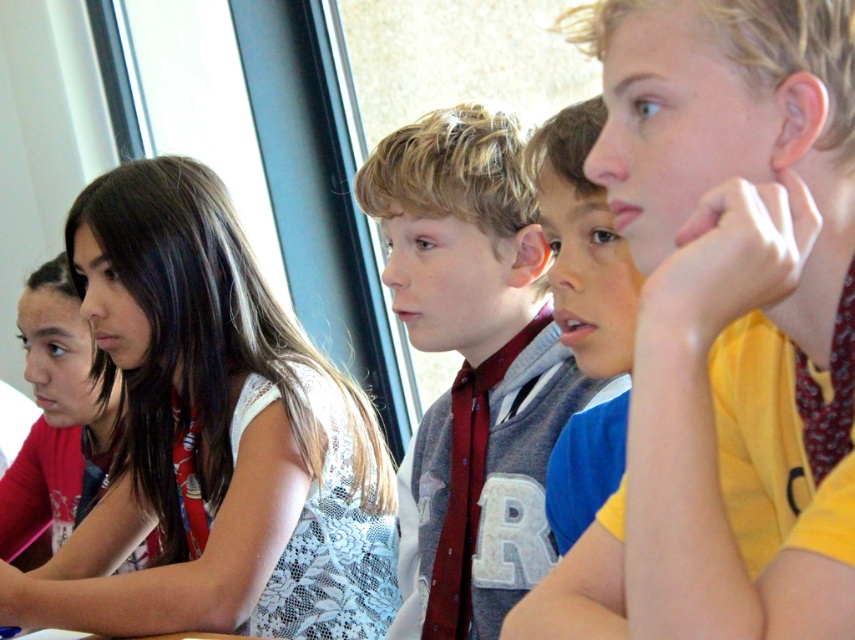
From the picture: You are a photographer trying to capture a group shot of the children in the classroom. You want to ensure that both the white lace dress at upper left and the maroon tie at center are visible in the frame. Based on their positions, which child should you position closer to the center of the photo to include both effectively?

The white lace dress at upper left is positioned on the left side of the maroon tie at center. To include both effectively, you should position the child wearing the maroon tie at center closer to the center of the photo so that the white lace dress at upper left remains visible on the left side.

You are a tailor who needs to determine which clothing item requires more fabric between the white lace dress at upper left and the matte red tie at center. Which one would need more fabric?

The white lace dress at upper left requires more fabric than the matte red tie at center because it is bigger.

You are a photographer standing 2 meters away from the camera position. You want to take a photo of the children in the classroom. However, there is an obstacle 1.5 meters away from the camera. Will you be able to reach the point at coordinates point (x=160, y=244) without passing through the obstacle?

The distance of point (x=160, y=244) from the camera is 1.69 meters. Since the obstacle is at 1.5 meters from the camera, you would have to pass through it to reach the point. Therefore, you cannot reach the point without going through the obstacle.